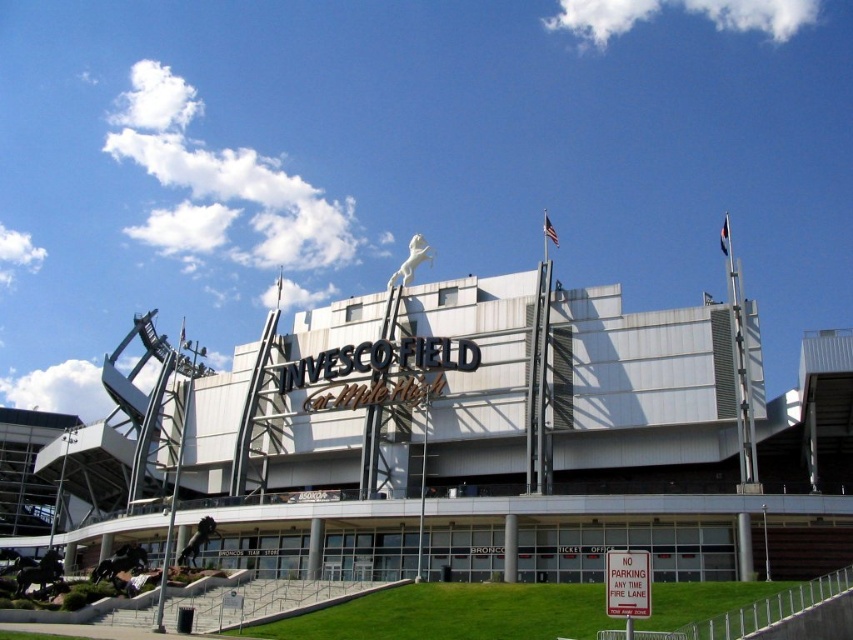
Can you confirm if polished bronze horse at lower left is thinner than bronze statue at lower center?

In fact, polished bronze horse at lower left might be wider than bronze statue at lower center.

Which is behind, point (53, 548) or point (206, 529)?

The point (53, 548) is more distant.

Locate an element on the screen. polished bronze horse at lower left is located at coordinates (38, 572).

Who is shorter, bronze horse statue at lower left or white glossy horse at upper center?

With less height is bronze horse statue at lower left.

Locate an element on the screen. The height and width of the screenshot is (640, 853). bronze horse statue at lower left is located at coordinates (120, 563).

Does point (131, 547) come farther from viewer compared to point (409, 280)?

No, it is not.

Locate an element on the screen. bronze horse statue at lower left is located at coordinates (120, 563).

Between point (260, 371) and point (416, 257), which one is positioned behind?

Point (416, 257)

Looking at this image, which is more to the left, white metallic building at center or white glossy horse at upper center?

white glossy horse at upper center

Between point (317, 420) and point (421, 253), which one is positioned behind?

The point (421, 253) is more distant.

You are a GUI agent. You are given a task and a screenshot of the screen. Output one action in this format:
    pyautogui.click(x=<x>, y=<y>)
    Task: Click on the white metallic building at center
    The width and height of the screenshot is (853, 640).
    Given the screenshot: What is the action you would take?
    pyautogui.click(x=471, y=444)